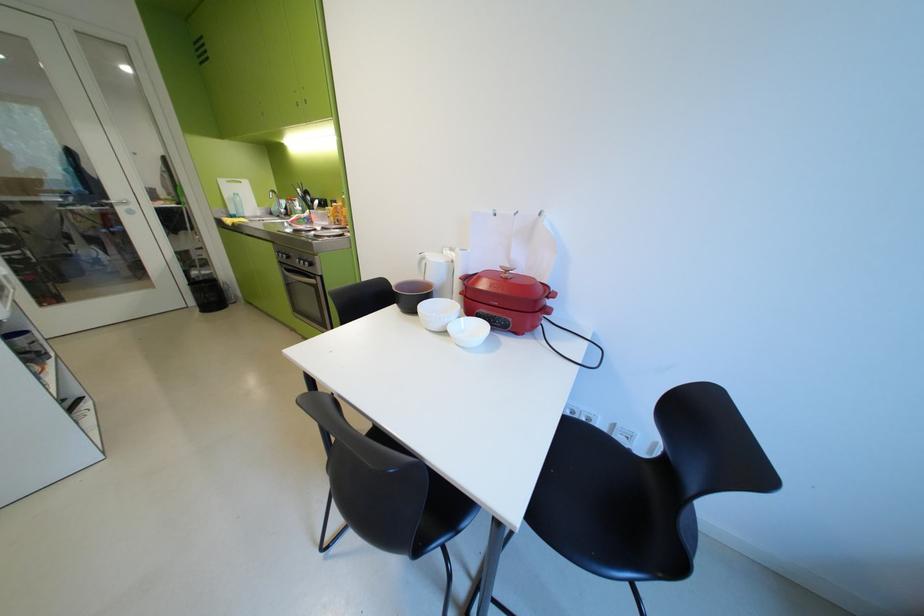
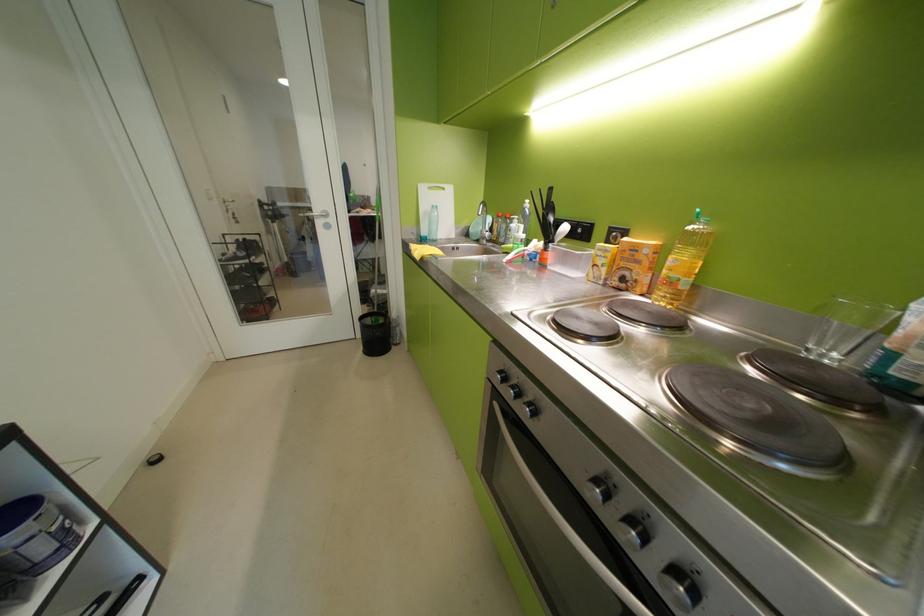
The point at (x=356, y=217) is marked in the first image. Where is the corresponding point in the second image?

(681, 284)